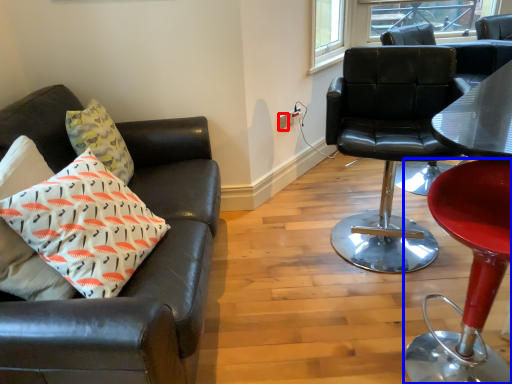
Question: Which point is closer to the camera, power outlet (highlighted by a red box) or chair (highlighted by a blue box)?

Choices:
 (A) power outlet
 (B) chair

Answer: (B)